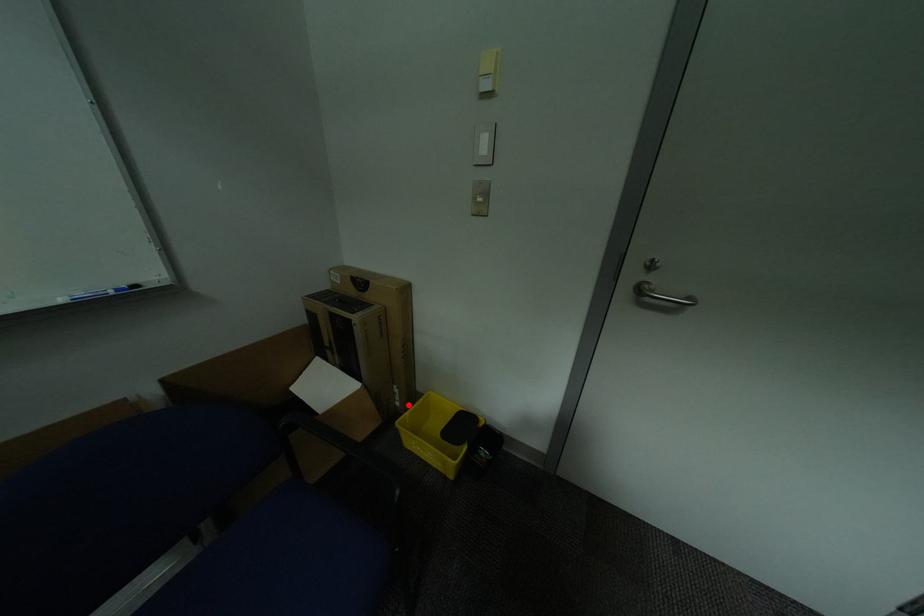
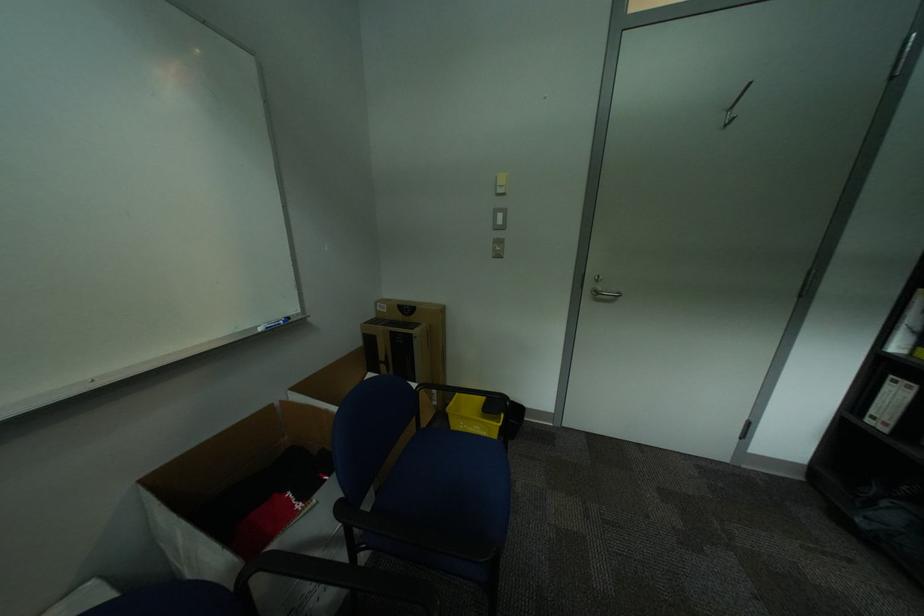
Find the pixel in the second image that matches the highlighted location in the first image.

(445, 403)